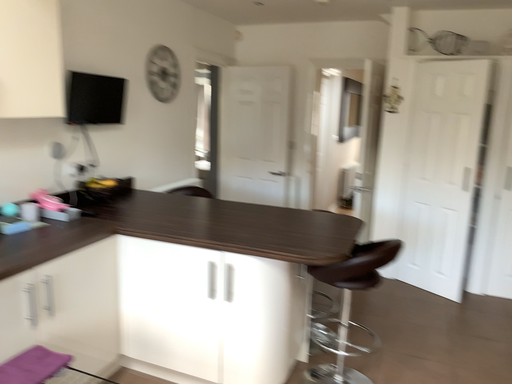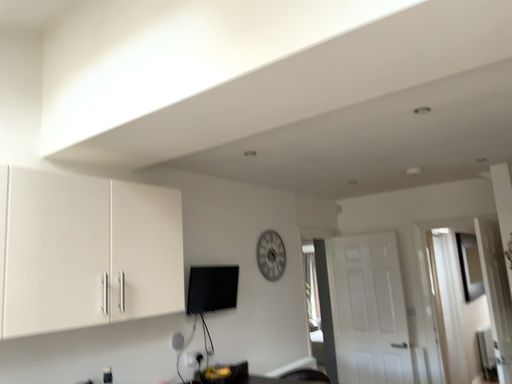
Question: Which way did the camera rotate in the video?

Choices:
 (A) rotated upward
 (B) rotated downward

Answer: (A)